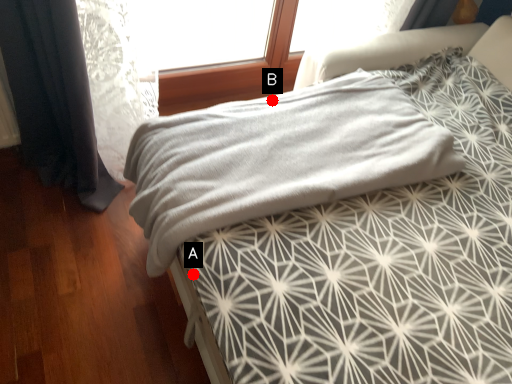
Question: Two points are circled on the image, labeled by A and B beside each circle. Which of the following is the closest to the observer?

Choices:
 (A) A is closer
 (B) B is closer

Answer: (A)